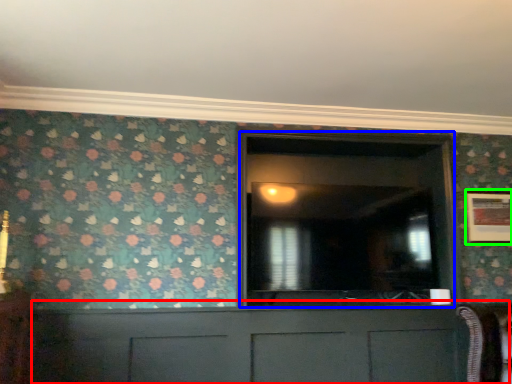
Question: Which object is the closest to the cabinetry (highlighted by a red box)? Choose among these: glass door (highlighted by a blue box) or picture frame (highlighted by a green box).

Choices:
 (A) glass door
 (B) picture frame

Answer: (A)